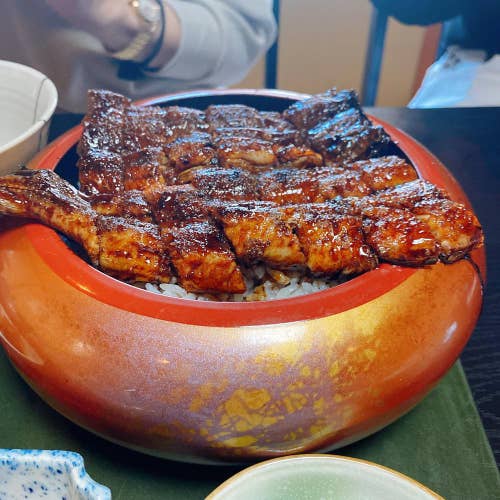
Identify the location of blue and white bowl. coord(19,485).